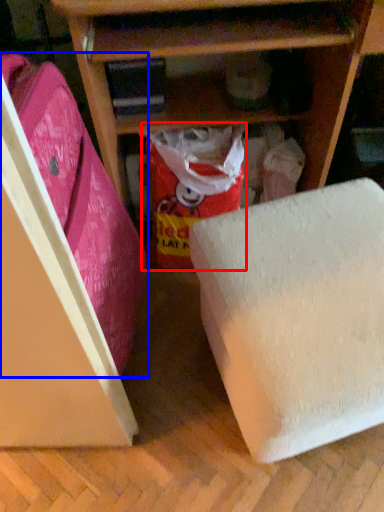
Question: Among these objects, which one is farthest to the camera, wrapping paper (highlighted by a red box) or leftover (highlighted by a blue box)?

Choices:
 (A) wrapping paper
 (B) leftover

Answer: (A)